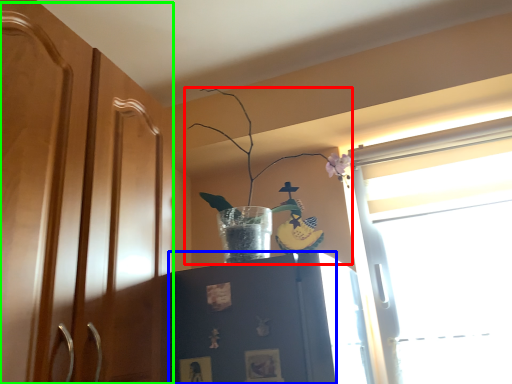
Question: Based on their relative distances, which object is farther from houseplant (highlighted by a red box)? Choose from cabinetry (highlighted by a blue box) and dresser (highlighted by a green box).

Choices:
 (A) cabinetry
 (B) dresser

Answer: (B)